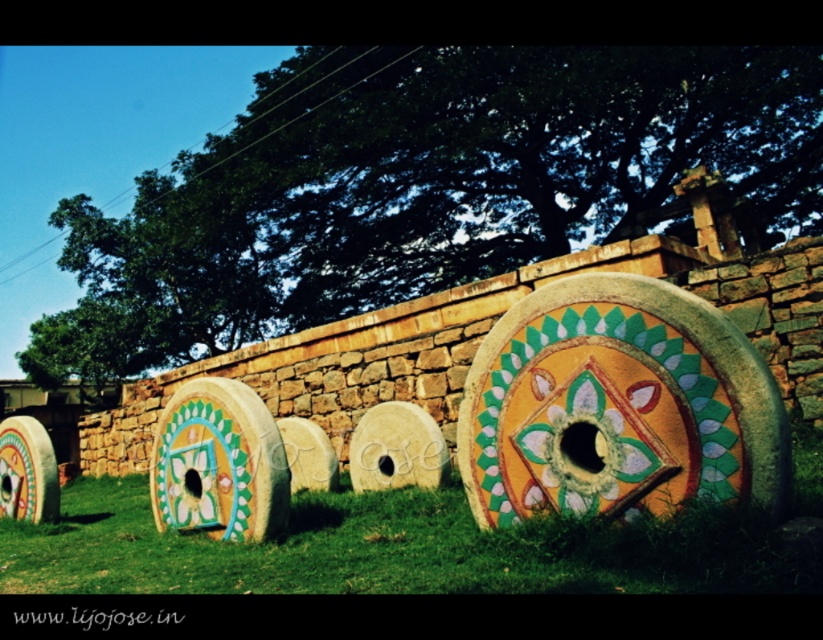
You are standing in front of the stone structures and want to take a photo. You notice two points marked on the image at coordinates point [738,540] and point [19,518]. Which point will appear larger in your photo?

Point [738,540] is closer to the camera than point [19,518], so it will appear larger in the photo.